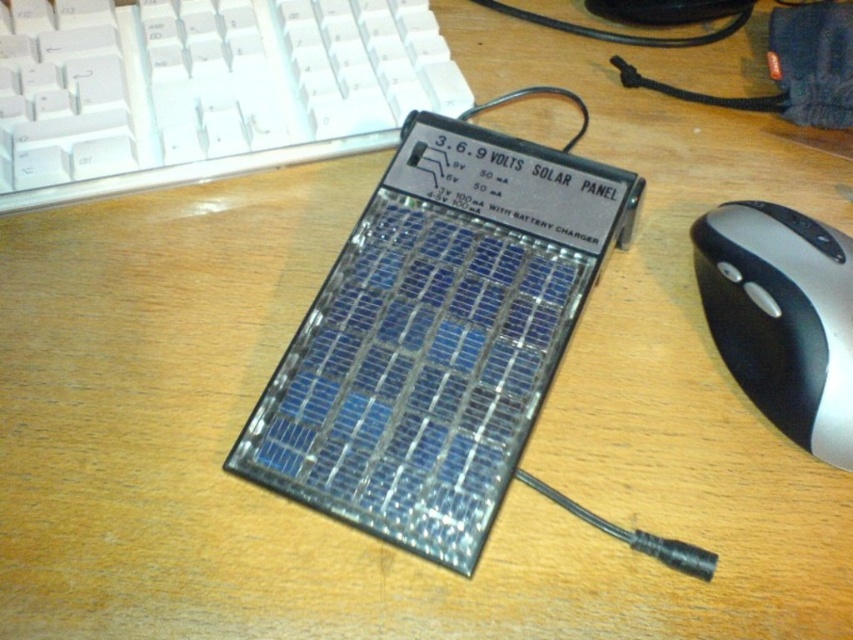
Question: Is white plastic keyboard at upper left below silver/black plastic mouse at right?

Choices:
 (A) yes
 (B) no

Answer: (B)

Question: Which point is farther from the camera taking this photo?

Choices:
 (A) (317, 45)
 (B) (763, 330)

Answer: (A)

Question: Does white plastic keyboard at upper left appear on the left side of silver/black plastic mouse at right?

Choices:
 (A) no
 (B) yes

Answer: (B)

Question: Which object appears closest to the camera in this image?

Choices:
 (A) white plastic keyboard at upper left
 (B) silver/black plastic mouse at right

Answer: (B)

Question: Does white plastic keyboard at upper left lie in front of silver/black plastic mouse at right?

Choices:
 (A) no
 (B) yes

Answer: (A)

Question: Which point is closer to the camera?

Choices:
 (A) (207, 164)
 (B) (722, 355)

Answer: (B)